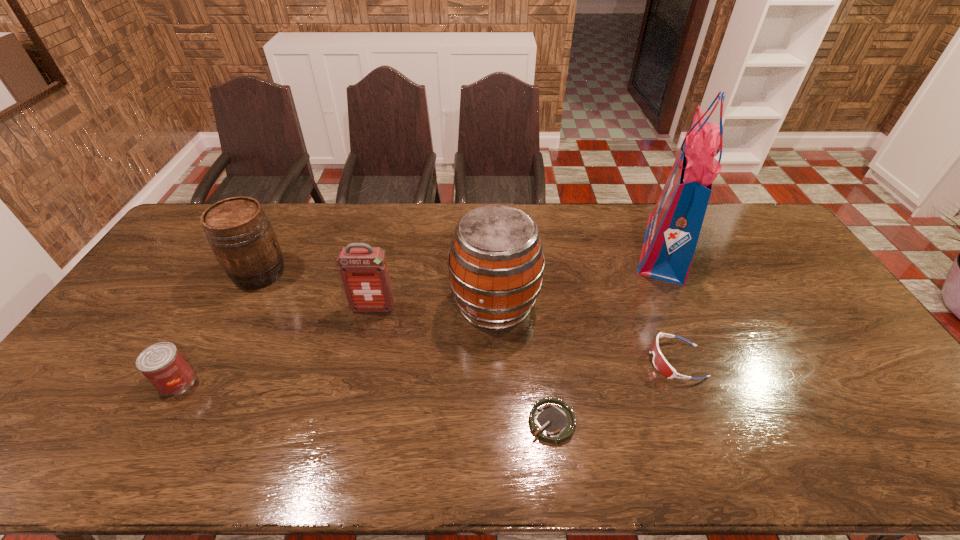
At what (x,y) coordinates should I click in order to perform the action: click on free space located 0.100m on the front-facing side of the tallest object. Please return your answer as a coordinate pair (x, y). Looking at the image, I should click on (598, 246).

Where is `vacant region located on the front-facing side of the tallest object`? This screenshot has height=540, width=960. vacant region located on the front-facing side of the tallest object is located at coordinates (512, 246).

Find the location of `vacant area situated 0.260m on the back of the right cider`. vacant area situated 0.260m on the back of the right cider is located at coordinates (492, 226).

Where is `free space located 0.060m on the front-facing side of the first-aid kit`? The width and height of the screenshot is (960, 540). free space located 0.060m on the front-facing side of the first-aid kit is located at coordinates (368, 329).

Locate an element on the screen. This screenshot has height=540, width=960. vacant space located on the side of the shorter cider near the bung hole is located at coordinates (352, 273).

This screenshot has height=540, width=960. I want to click on vacant space situated on the front of the can, so click(134, 454).

The image size is (960, 540). I want to click on vacant space located on the front-facing side of the second shortest object, so click(x=538, y=361).

Where is `free spot located 0.180m on the front-facing side of the second shortest object`? The image size is (960, 540). free spot located 0.180m on the front-facing side of the second shortest object is located at coordinates (583, 361).

Find the location of a particular element. vacant space positioned 0.340m on the front-facing side of the second shortest object is located at coordinates (523, 361).

Find the location of `free space located 0.070m on the back of the shortest object`. free space located 0.070m on the back of the shortest object is located at coordinates (546, 377).